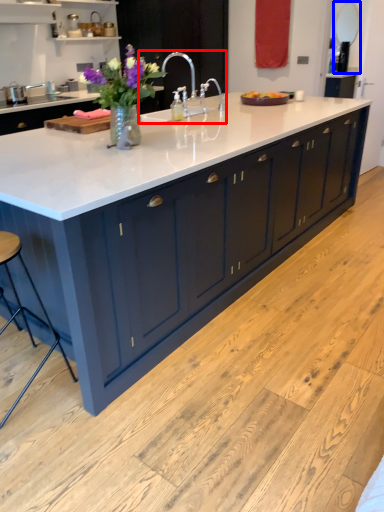
Question: Among these objects, which one is farthest to the camera, sink (highlighted by a red box) or mirror (highlighted by a blue box)?

Choices:
 (A) sink
 (B) mirror

Answer: (B)